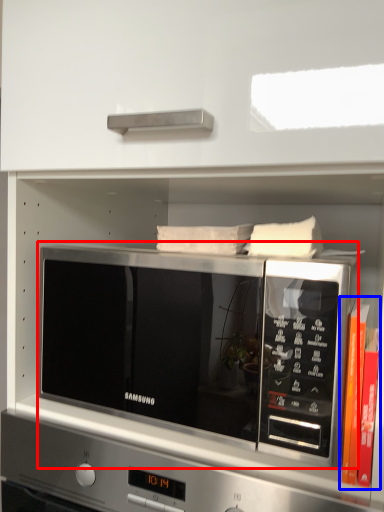
Question: Which point is further to the camera, microwave oven (highlighted by a red box) or book (highlighted by a blue box)?

Choices:
 (A) microwave oven
 (B) book

Answer: (B)